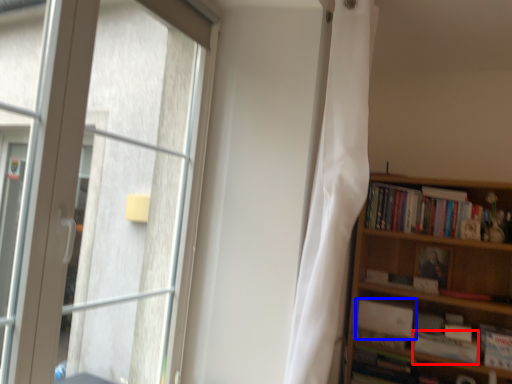
Question: Which point is further to the camera, paperback book (highlighted by a red box) or book (highlighted by a blue box)?

Choices:
 (A) paperback book
 (B) book

Answer: (B)